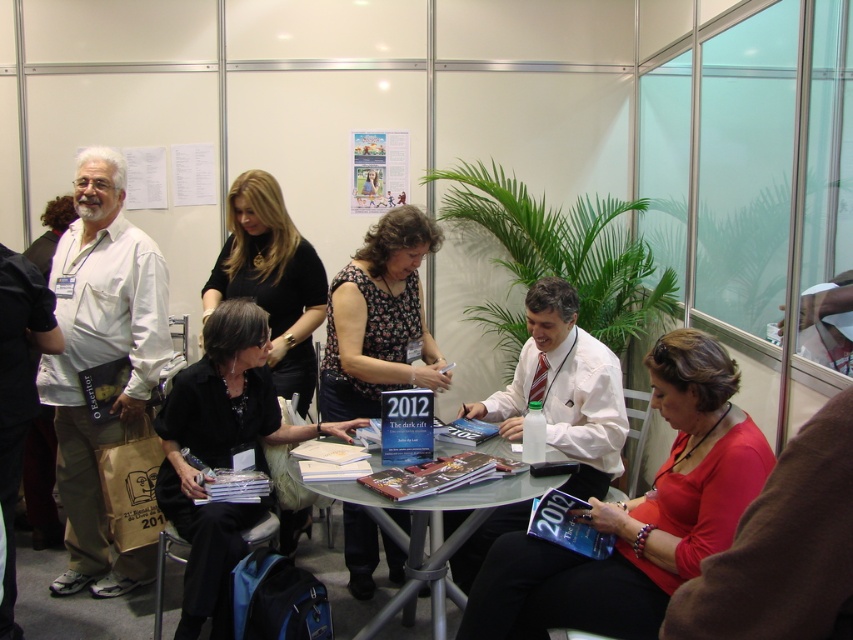
Question: Which object is closer to the camera taking this photo?

Choices:
 (A) floral print blouse at center
 (B) black matte shirt at center
 (C) matte red shirt at center

Answer: (C)

Question: Which point is closer to the camera?

Choices:
 (A) matte red shirt at center
 (B) floral print blouse at center

Answer: (A)

Question: Does black matte shirt at center have a greater width compared to black fabric shirt at center?

Choices:
 (A) yes
 (B) no

Answer: (A)

Question: From the image, what is the correct spatial relationship of matte red shirt at center in relation to black fabric shirt at center?

Choices:
 (A) left
 (B) right

Answer: (B)

Question: Among these objects, which one is nearest to the camera?

Choices:
 (A) black matte shirt at center
 (B) clear glass table at center

Answer: (B)

Question: In this image, where is black matte shirt at center located relative to black fabric shirt at center?

Choices:
 (A) left
 (B) right

Answer: (B)